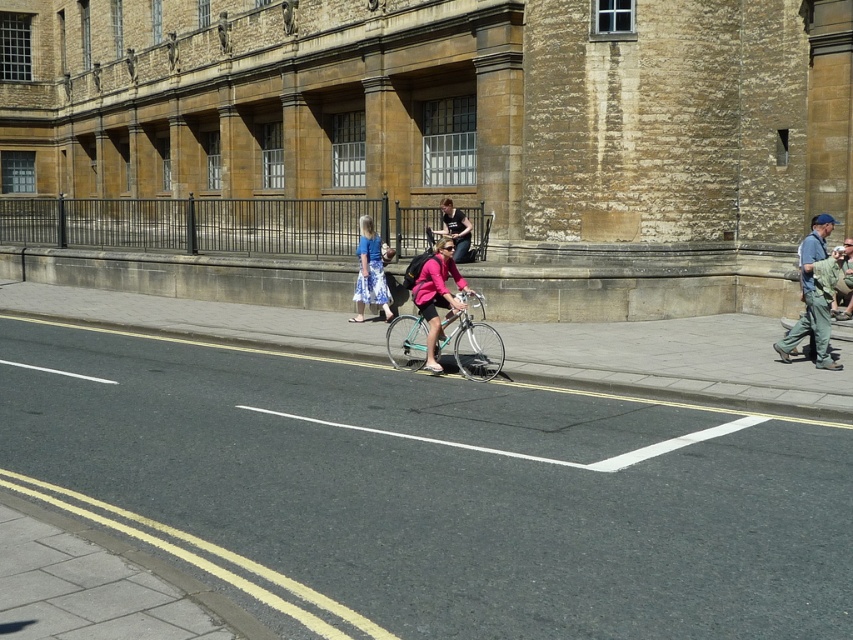
Who is positioned more to the left, black asphalt bike lane at center or matte blue dress at center?

matte blue dress at center is more to the left.

Is black asphalt bike lane at center to the right of matte blue dress at center from the viewer's perspective?

Correct, you'll find black asphalt bike lane at center to the right of matte blue dress at center.

Identify the location of black asphalt bike lane at center. This screenshot has height=640, width=853. (434, 492).

You are a GUI agent. You are given a task and a screenshot of the screen. Output one action in this format:
    pyautogui.click(x=<x>, y=<y>)
    Task: Click on the black asphalt bike lane at center
    
    Given the screenshot: What is the action you would take?
    pyautogui.click(x=434, y=492)

Is teal metallic bicycle at center shorter than matte blue dress at center?

Yes, teal metallic bicycle at center is shorter than matte blue dress at center.

Does point (442, 340) come behind point (368, 296)?

No, it is in front of (368, 296).

Locate an element on the screen. The image size is (853, 640). teal metallic bicycle at center is located at coordinates (473, 342).

In order to click on teal metallic bicycle at center in this screenshot , I will do `click(473, 342)`.

Which of these two, teal metallic bicycle at center or matte pink jacket at center, stands taller?

matte pink jacket at center is taller.

From the picture: Which is above, teal metallic bicycle at center or matte pink jacket at center?

matte pink jacket at center is above.

Identify the location of teal metallic bicycle at center. This screenshot has height=640, width=853. (473, 342).